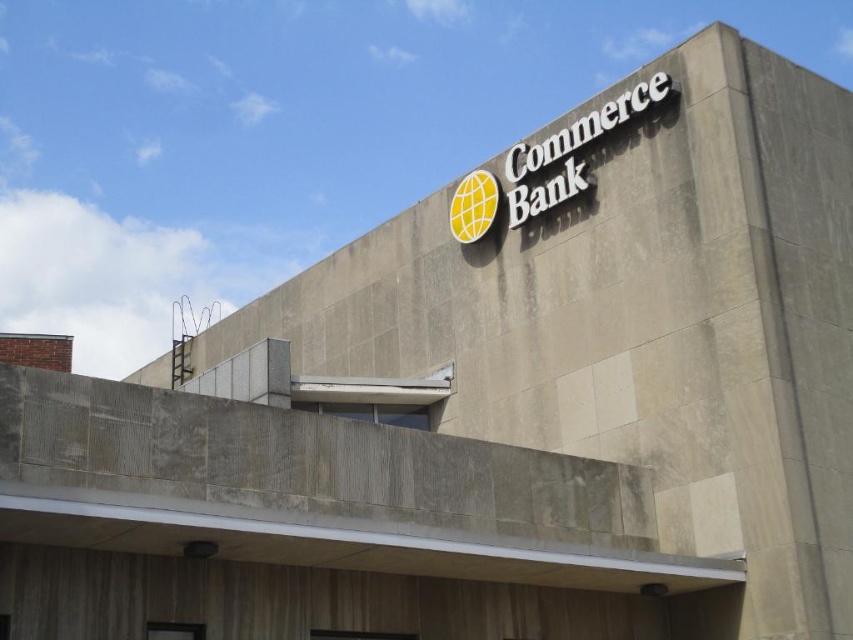
You are standing 50 meters away from a building. You want to reach a specific point marked at coordinates point (x=520, y=182) on the building. Can you reach it without moving closer than 40 meters from the building?

The point (x=520, y=182) is 45.78 meters away from the viewer. Since you are currently standing 50 meters away and need to stay at least 40 meters away, you can reach it without moving closer than 40 meters because 45.78 meters is within the 40 to 50 meter range.

You are standing in front of the Commerce Bank building and want to locate the bank name and its logo. Which object is above the other between the white metallic sign at upper center and the yellow matte globe at center?

The white metallic sign at upper center is positioned over the yellow matte globe at center, so the bank name is above the logo.